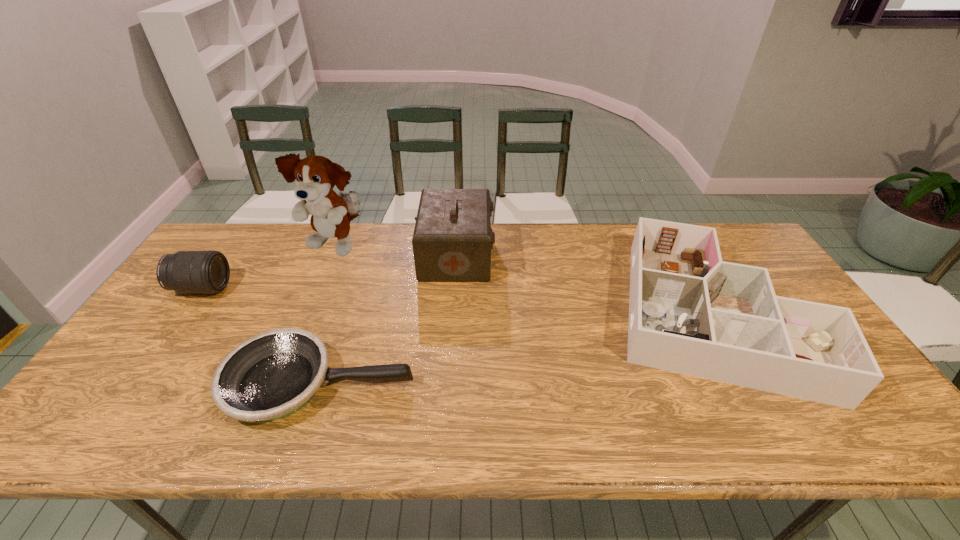
At what (x,y) coordinates should I click in order to perform the action: click on blank region between the frying pan and the dollhouse. Please return your answer as a coordinate pair (x, y). Looking at the image, I should click on (515, 349).

You are a GUI agent. You are given a task and a screenshot of the screen. Output one action in this format:
    pyautogui.click(x=<x>, y=<y>)
    Task: Click on the vacant space in between the puppy and the shortest object
    Image resolution: width=960 pixels, height=540 pixels.
    Given the screenshot: What is the action you would take?
    pyautogui.click(x=327, y=315)

You are a GUI agent. You are given a task and a screenshot of the screen. Output one action in this format:
    pyautogui.click(x=<x>, y=<y>)
    Task: Click on the object that is the fourth closest to the telephoto lens
    
    Given the screenshot: What is the action you would take?
    pyautogui.click(x=691, y=313)

Find the location of `object that is the fourth nearest to the puppy`. object that is the fourth nearest to the puppy is located at coordinates (691, 313).

The image size is (960, 540). I want to click on vacant region that satisfies the following two spatial constraints: 1. on the back side of the rightmost object; 2. on the surface of the leftmost object, so click(x=695, y=288).

At what (x,y) coordinates should I click in order to perform the action: click on vacant space that satisfies the following two spatial constraints: 1. on the face of the tallest object; 2. on the right side of the rightmost object. Please return your answer as a coordinate pair (x, y). Looking at the image, I should click on (308, 314).